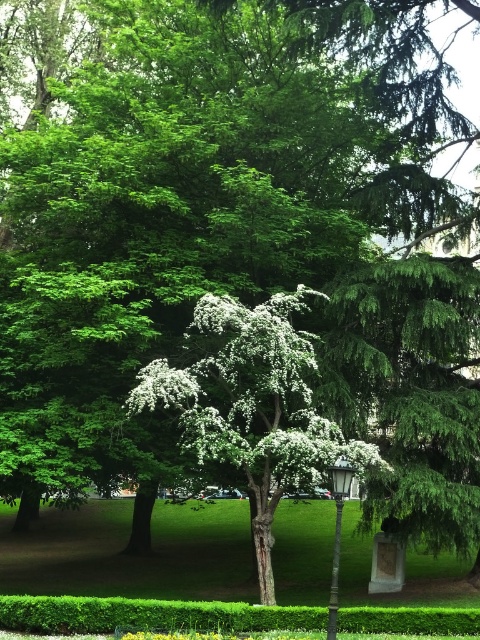
Is white blossoming tree at center smaller than metallic gray lamp post at center?

No, white blossoming tree at center is not smaller than metallic gray lamp post at center.

Which is in front, point (268, 461) or point (333, 488)?

Point (333, 488) is more forward.

Locate an element on the screen. The image size is (480, 640). white blossoming tree at center is located at coordinates (251, 404).